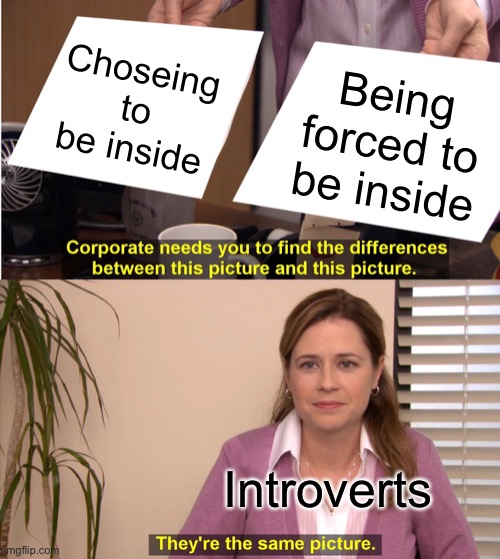
The image size is (500, 559). Find the location of `fan`. fan is located at coordinates (15, 175).